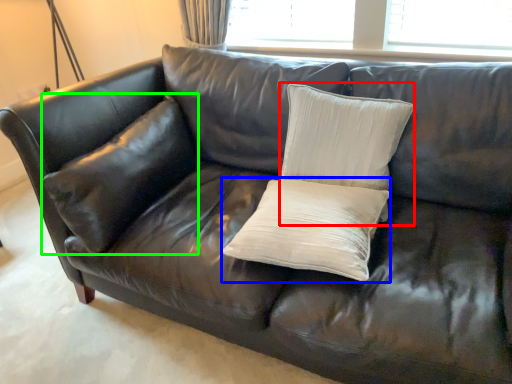
Question: Based on their relative distances, which object is farther from pillow (highlighted by a red box)? Choose from pillow (highlighted by a blue box) and pillow (highlighted by a green box).

Choices:
 (A) pillow
 (B) pillow

Answer: (B)